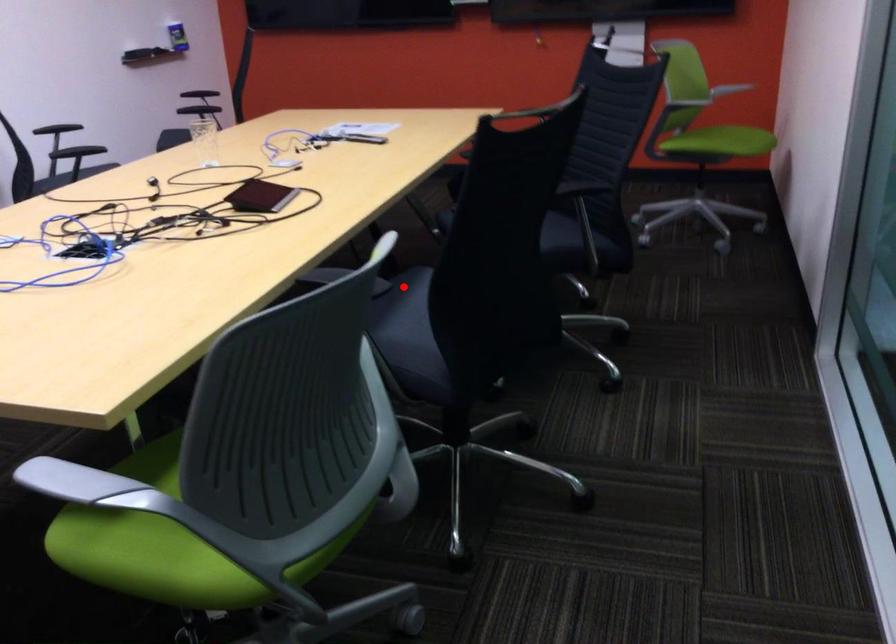
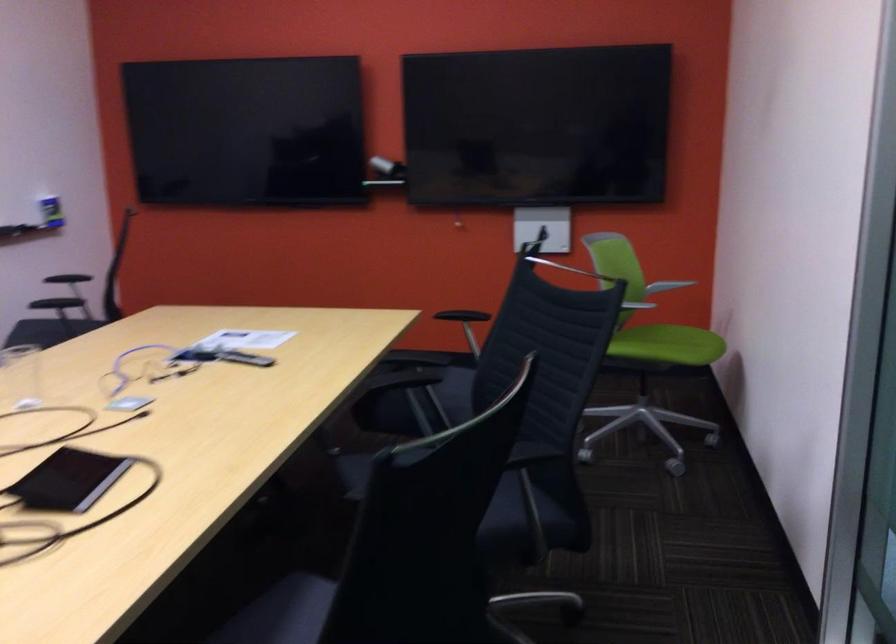
Locate, in the second image, the point that corresponds to the highlighted location in the first image.

(280, 612)